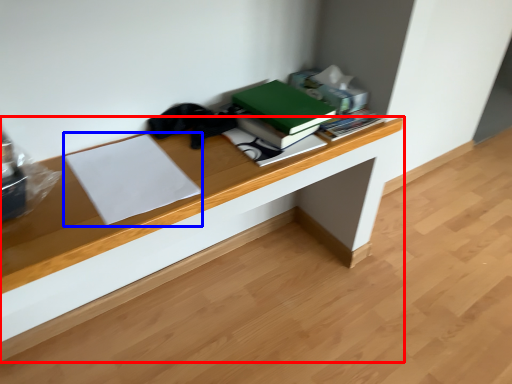
Question: Which object is closer to the camera taking this photo, desk (highlighted by a red box) or paperback book (highlighted by a blue box)?

Choices:
 (A) desk
 (B) paperback book

Answer: (B)